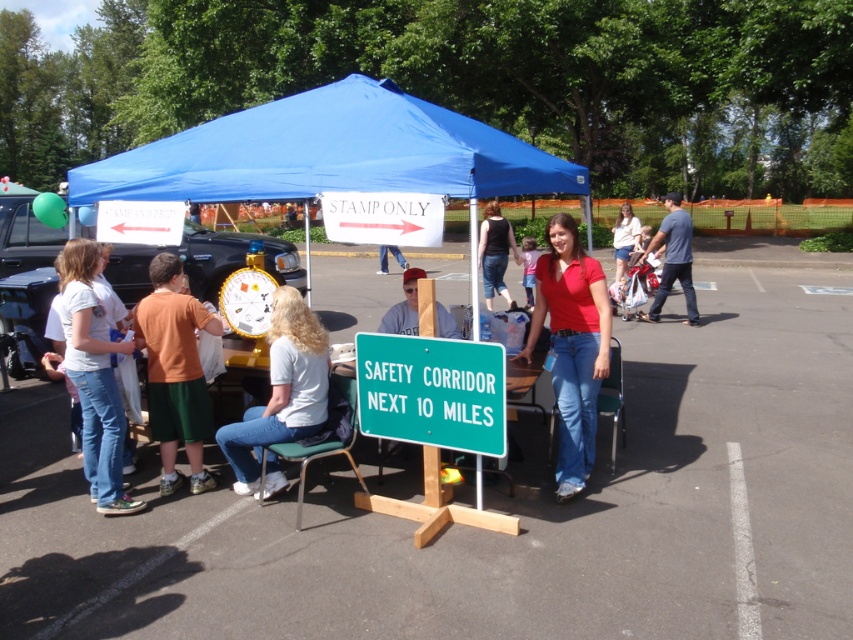
Question: Can you confirm if black tank top at center is smaller than jeans at center?

Choices:
 (A) yes
 (B) no

Answer: (B)

Question: Observing the image, what is the correct spatial positioning of green metal sign at center in reference to black tank top at center?

Choices:
 (A) right
 (B) left

Answer: (A)

Question: Which object appears closest to the camera in this image?

Choices:
 (A) matte gray shirt at center
 (B) green metal sign at center
 (C) green metallic sign at center

Answer: (B)

Question: Where is blue fabric canopy at center located in relation to jeans at center in the image?

Choices:
 (A) right
 (B) left

Answer: (A)

Question: Among these objects, which one is farthest from the camera?

Choices:
 (A) black tank top at center
 (B) red cotton shirt at center

Answer: (A)

Question: Which object is positioned farthest from the green metal sign at center?

Choices:
 (A) white fabric clock at center
 (B) jeans at center

Answer: (B)